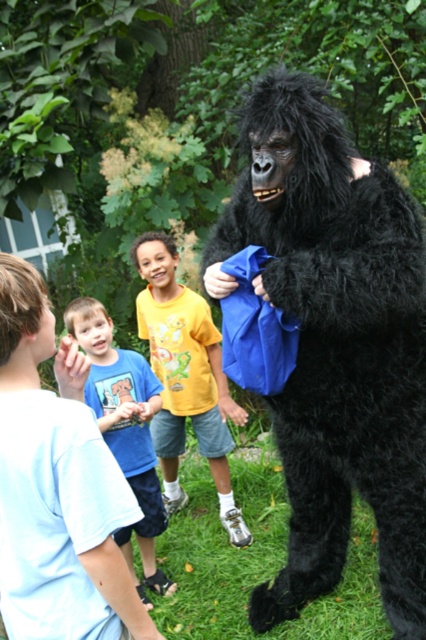
Between point (198, 348) and point (146, 509), which one is positioned behind?

The point (198, 348) is behind.

Which is more to the right, yellow t-shirt at center or blue cotton shirt at center?

From the viewer's perspective, yellow t-shirt at center appears more on the right side.

Who is more forward, (152, 317) or (111, 403)?

Positioned in front is point (111, 403).

At what (x,y) coordinates should I click in order to perform the action: click on yellow t-shirt at center. Please return your answer as a coordinate pair (x, y). The image size is (426, 640). Looking at the image, I should click on (186, 378).

Does point (423, 520) come behind point (161, 288)?

No.

Does black furry gorilla at right have a greater height compared to yellow t-shirt at center?

Correct, black furry gorilla at right is much taller as yellow t-shirt at center.

Describe the element at coordinates (336, 342) in the screenshot. I see `black furry gorilla at right` at that location.

Where is `black furry gorilla at right`? Image resolution: width=426 pixels, height=640 pixels. black furry gorilla at right is located at coordinates (336, 342).

Between black furry gorilla at right and blue cotton shirt at center, which one has less height?

blue cotton shirt at center is shorter.

Who is higher up, black furry gorilla at right or blue cotton shirt at center?

black furry gorilla at right is above.

Which is behind, point (345, 160) or point (140, 499)?

The point (140, 499) is behind.

Where is `black furry gorilla at right`? The width and height of the screenshot is (426, 640). black furry gorilla at right is located at coordinates (336, 342).